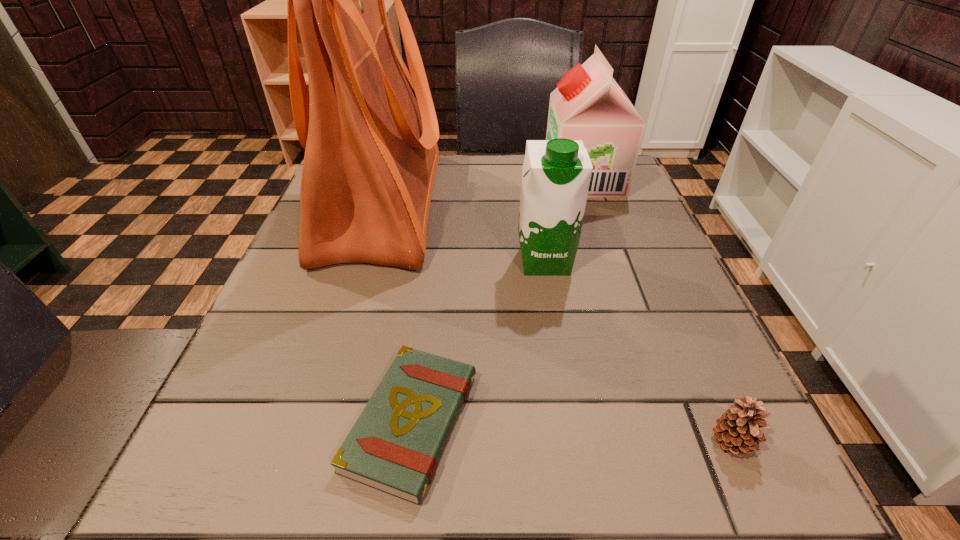
You are a GUI agent. You are given a task and a screenshot of the screen. Output one action in this format:
    pyautogui.click(x=<x>, y=<y>)
    Task: Click on the vacant region that satisfies the following two spatial constraints: 1. on the front-facing side of the fourth tallest object; 2. on the left side of the nearer soya milk
    Image resolution: width=960 pixels, height=540 pixels.
    Given the screenshot: What is the action you would take?
    pyautogui.click(x=576, y=443)

Where is `free space that satisfies the following two spatial constraints: 1. on the front-facing side of the nearer soya milk; 2. on the right side of the second shortest object`? The width and height of the screenshot is (960, 540). free space that satisfies the following two spatial constraints: 1. on the front-facing side of the nearer soya milk; 2. on the right side of the second shortest object is located at coordinates (576, 443).

Locate an element on the screen. free location that satisfies the following two spatial constraints: 1. with the cap open on the farther soya milk; 2. on the front-facing side of the nearer soya milk is located at coordinates (612, 260).